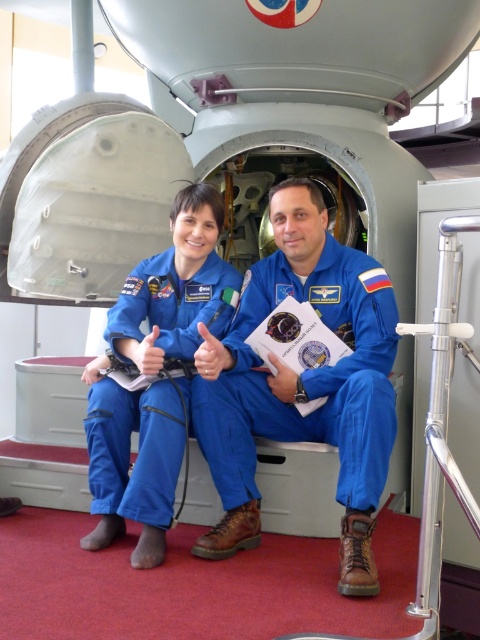
Can you confirm if blue fabric spacesuit at center is positioned above matte blue jumpsuit at center?

Indeed, blue fabric spacesuit at center is positioned over matte blue jumpsuit at center.

Between blue fabric spacesuit at center and matte blue jumpsuit at center, which one appears on the right side from the viewer's perspective?

From the viewer's perspective, blue fabric spacesuit at center appears more on the right side.

Between point (361, 476) and point (164, 513), which one is positioned behind?

Point (164, 513)

Image resolution: width=480 pixels, height=640 pixels. I want to click on blue fabric spacesuit at center, so [301, 384].